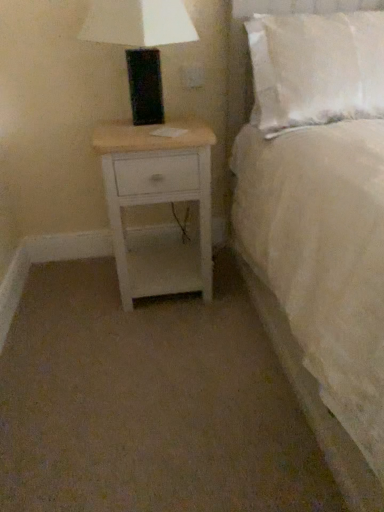
Locate an element on the screen. free location to the left of white soft bed at upper right is located at coordinates (129, 366).